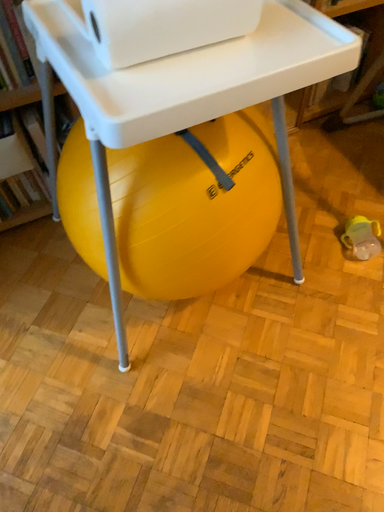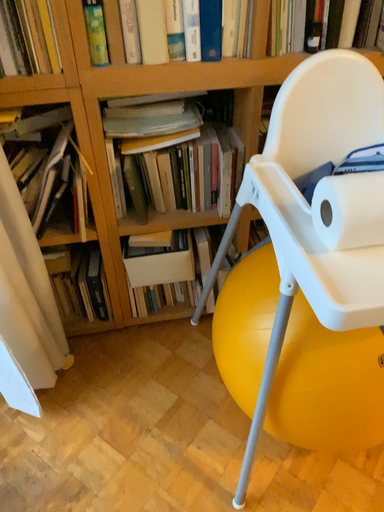
Question: Which way did the camera rotate in the video?

Choices:
 (A) rotated downward
 (B) rotated upward

Answer: (B)